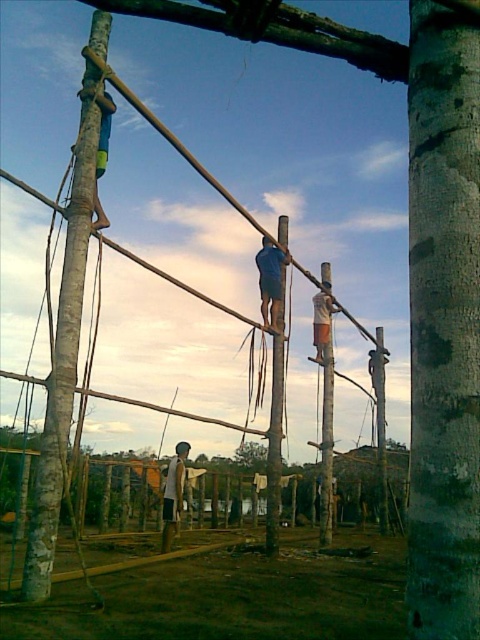
Question: Estimate the real-world distances between objects in this image. Which object is farther from the light brown wooden pole at center?

Choices:
 (A) white fabric shirt at center
 (B) smooth bamboo pole at center
 (C) blue fabric construction worker at center

Answer: (A)

Question: Is white fabric shirt at center closer to the viewer compared to light brown wooden pole at center?

Choices:
 (A) yes
 (B) no

Answer: (A)

Question: Does white fabric shirt at center have a larger size compared to light brown wooden pole at center?

Choices:
 (A) no
 (B) yes

Answer: (A)

Question: Among these points, which one is nearest to the camera?

Choices:
 (A) (273, 448)
 (B) (284, 253)
 (C) (172, 518)
 (D) (325, 291)

Answer: (A)

Question: Does smooth bamboo pole at center have a greater width compared to white fabric shirt at center?

Choices:
 (A) yes
 (B) no

Answer: (B)

Question: Which of the following is the closest to the observer?

Choices:
 (A) blue fabric construction worker at center
 (B) light brown wooden pole at center

Answer: (A)